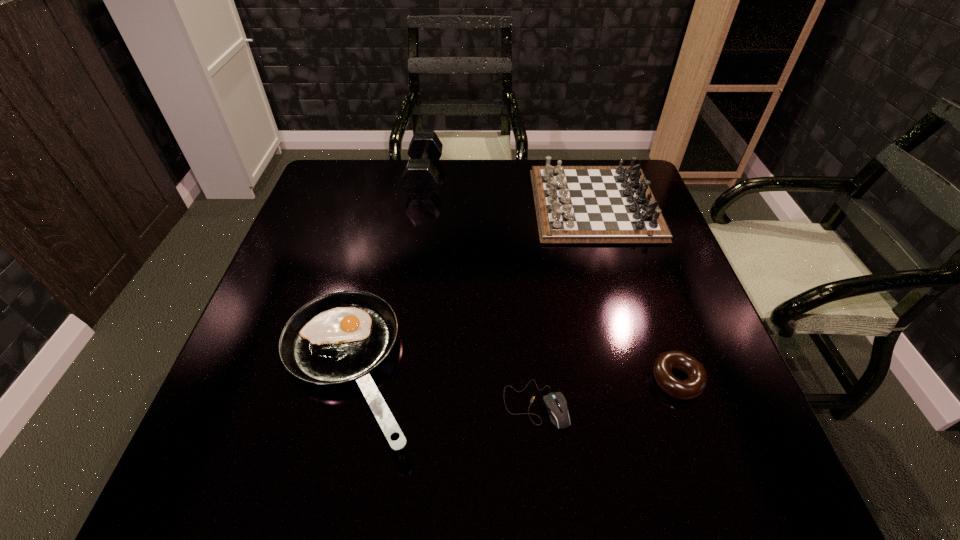
Identify the location of unoccupied position between the chessboard and the dumbbell. (510, 191).

The image size is (960, 540). I want to click on empty location between the third tallest object and the fourth shortest object, so click(x=471, y=287).

Image resolution: width=960 pixels, height=540 pixels. Identify the location of blank region between the dumbbell and the third tallest object. point(386,274).

The height and width of the screenshot is (540, 960). I want to click on empty space that is in between the dumbbell and the frying pan, so click(386, 274).

Identify the location of free spot between the computer mouse and the frying pan. (442, 387).

You are a GUI agent. You are given a task and a screenshot of the screen. Output one action in this format:
    pyautogui.click(x=<x>, y=<y>)
    Task: Click on the vacant area that lies between the dumbbell and the frying pan
    This screenshot has width=960, height=540.
    Given the screenshot: What is the action you would take?
    [x=386, y=274]

What are the coordinates of `vacant region between the shortest object and the second shortest object` in the screenshot? It's located at (606, 392).

Where is `the third closest object to the second tallest object`? the third closest object to the second tallest object is located at coordinates (692, 387).

Identify the location of object that ranks as the third closest to the computer mouse. (574, 204).

Locate an element on the screen. The width and height of the screenshot is (960, 540). free space that satisfies the following two spatial constraints: 1. on the front side of the doughnut; 2. on the right side of the dumbbell is located at coordinates (394, 380).